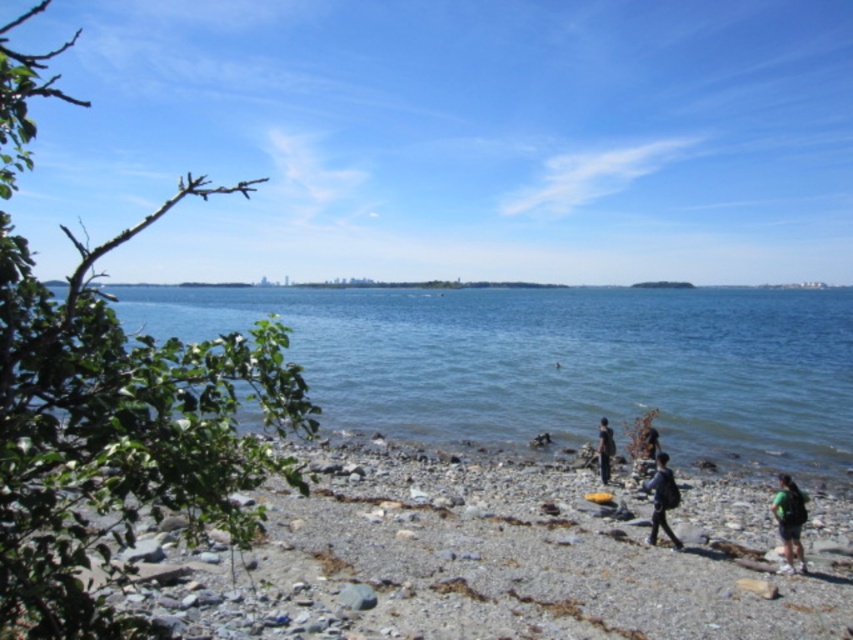
Does green fabric backpack at lower right have a lesser height compared to dark gray fabric jacket at center?

Yes, green fabric backpack at lower right is shorter than dark gray fabric jacket at center.

You are a GUI agent. You are given a task and a screenshot of the screen. Output one action in this format:
    pyautogui.click(x=<x>, y=<y>)
    Task: Click on the green fabric backpack at lower right
    
    Given the screenshot: What is the action you would take?
    pyautogui.click(x=788, y=518)

Which is more to the right, clear blue water at center or dark gray backpack at lower right?

clear blue water at center is more to the right.

Is clear blue water at center shorter than dark gray backpack at lower right?

No.

Is point (158, 296) positioned before point (659, 458)?

No, (158, 296) is further to viewer.

Where is `clear blue water at center`? This screenshot has height=640, width=853. clear blue water at center is located at coordinates (558, 362).

Consider the image. Who is shorter, clear blue water at center or green fabric backpack at lower right?

green fabric backpack at lower right

Between clear blue water at center and green fabric backpack at lower right, which one is positioned higher?

clear blue water at center is above.

At what (x,y) coordinates should I click in order to perform the action: click on clear blue water at center. Please return your answer as a coordinate pair (x, y). This screenshot has width=853, height=640. Looking at the image, I should click on (558, 362).

Locate an element on the screen. clear blue water at center is located at coordinates coord(558,362).